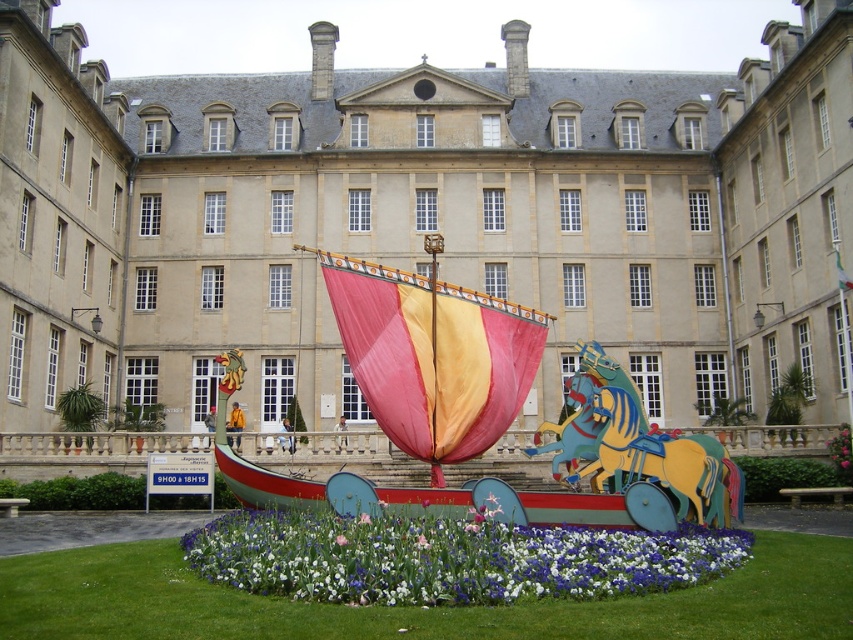
You are an artist who wants to paint the sculpture in the courtyard. You notice two flowers on the sculpture. Which flower is placed higher up on the sculpture? The options are the purple fabric flower at center and the pink fabric flower at center.

The purple fabric flower at center is positioned over the pink fabric flower at center, so it is higher up.

You are standing in the courtyard looking at the sculpture. There are two points marked on the sculpture. The first point is at coordinates point (699, 572) and the second is at point (337, 538). Which point is closer to your viewpoint?

Point (699, 572) is closer to the camera than point (337, 538), so the first point is closer to your viewpoint.